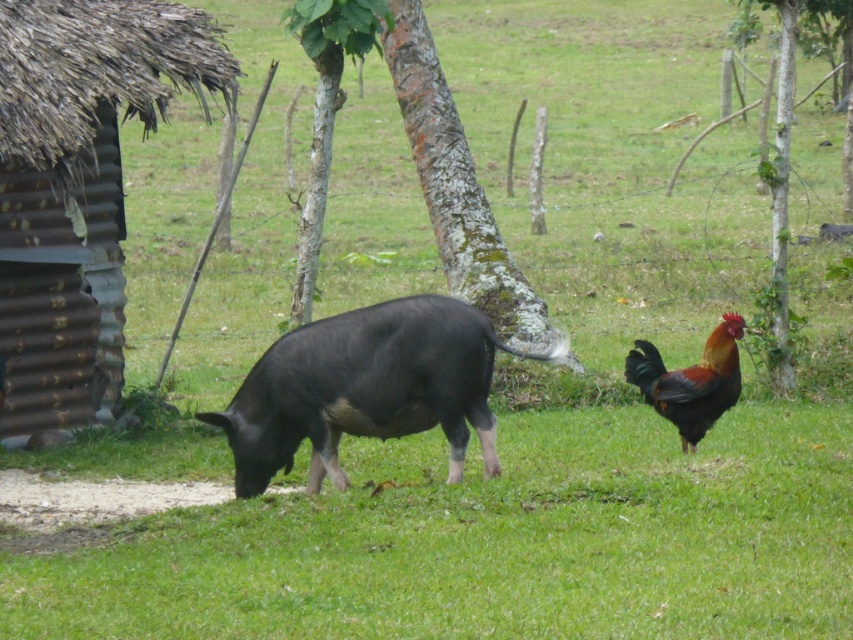
You are a birdwatcher observing the scene. You notice a point marked at coordinates (x=457, y=188). What object is located at that point?

The point at coordinates (x=457, y=188) indicates a green rough bark tree at center.

You are a farmer checking the field. You notice a point marked at coordinates (x=78, y=177). Based on the scene, what does this point likely indicate?

The point at coordinates (x=78, y=177) corresponds to the rusty corrugated hut at left, which is where the pig is grazing nearby.

In the rural scene with a pig and a rooster, where exactly is the green rough bark tree at center located in terms of coordinates?

The green rough bark tree at center is located at coordinates point (457, 188).